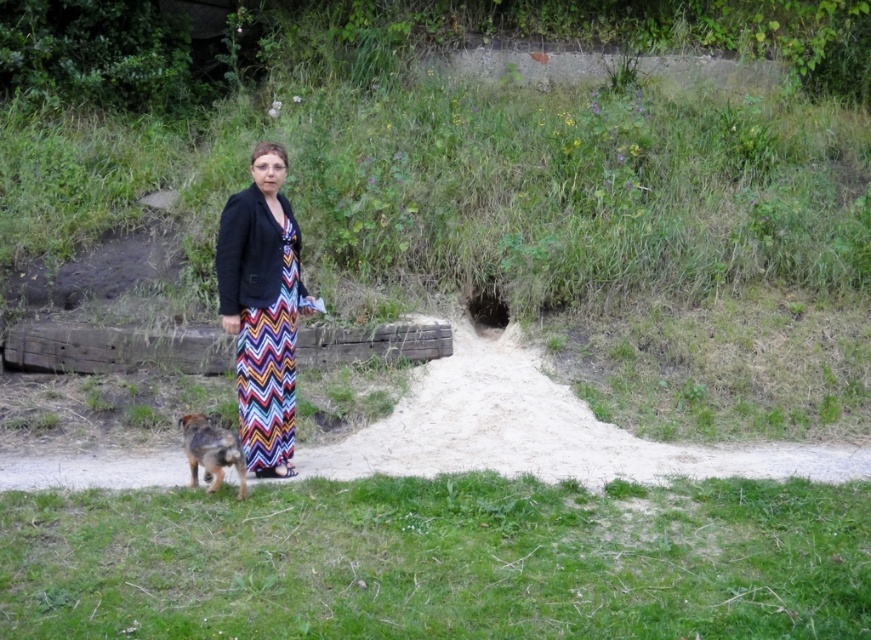
Question: Considering the relative positions of green grassy hillside at center and sandy dirt path at center in the image provided, where is green grassy hillside at center located with respect to sandy dirt path at center?

Choices:
 (A) below
 (B) above

Answer: (B)

Question: Can you confirm if patterned fabric dress at center is thinner than brown fur dog at lower left?

Choices:
 (A) no
 (B) yes

Answer: (A)

Question: Based on their relative distances, which object is nearer to the green grass at lower center?

Choices:
 (A) sandy dirt path at center
 (B) green grassy hillside at center
 (C) patterned fabric dress at center
 (D) brown fur dog at lower left

Answer: (A)

Question: Which point appears closest to the camera in this image?

Choices:
 (A) [223, 456]
 (B) [248, 461]
 (C) [219, 312]
 (D) [849, 497]

Answer: (A)

Question: Considering the real-world distances, which object is farthest from the sandy dirt path at center?

Choices:
 (A) green grass at lower center
 (B) green grassy hillside at center
 (C) brown fur dog at lower left

Answer: (B)

Question: In this image, where is sandy dirt path at center located relative to patterned fabric dress at center?

Choices:
 (A) above
 (B) below

Answer: (B)